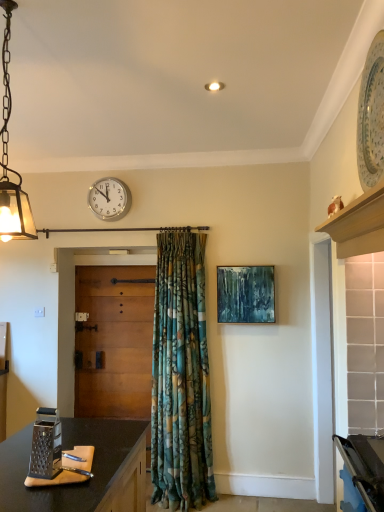
Question: Does teal textured canvas at center have a greater width compared to wooden door at center?

Choices:
 (A) yes
 (B) no

Answer: (B)

Question: Can you confirm if teal textured canvas at center is smaller than wooden door at center?

Choices:
 (A) yes
 (B) no

Answer: (A)

Question: Considering the relative sizes of teal textured canvas at center and wooden door at center in the image provided, is teal textured canvas at center taller than wooden door at center?

Choices:
 (A) yes
 (B) no

Answer: (B)

Question: Is wooden door at center surrounded by teal textured canvas at center?

Choices:
 (A) yes
 (B) no

Answer: (B)

Question: Considering the relative sizes of teal textured canvas at center and wooden door at center in the image provided, is teal textured canvas at center shorter than wooden door at center?

Choices:
 (A) yes
 (B) no

Answer: (A)

Question: Considering the relative sizes of teal textured canvas at center and wooden door at center in the image provided, is teal textured canvas at center bigger than wooden door at center?

Choices:
 (A) yes
 (B) no

Answer: (B)

Question: Is white plastic wall clock at upper center far away from wooden door at center?

Choices:
 (A) no
 (B) yes

Answer: (A)

Question: Does white plastic wall clock at upper center contain wooden door at center?

Choices:
 (A) yes
 (B) no

Answer: (B)

Question: Considering the relative sizes of white plastic wall clock at upper center and wooden door at center in the image provided, is white plastic wall clock at upper center wider than wooden door at center?

Choices:
 (A) no
 (B) yes

Answer: (A)

Question: Does white plastic wall clock at upper center have a lesser width compared to wooden door at center?

Choices:
 (A) yes
 (B) no

Answer: (A)

Question: Considering the relative sizes of white plastic wall clock at upper center and wooden door at center in the image provided, is white plastic wall clock at upper center shorter than wooden door at center?

Choices:
 (A) no
 (B) yes

Answer: (B)

Question: From the image's perspective, is white plastic wall clock at upper center under wooden door at center?

Choices:
 (A) no
 (B) yes

Answer: (A)

Question: From the image's perspective, is teal textured canvas at center below white plastic wall clock at upper center?

Choices:
 (A) yes
 (B) no

Answer: (A)